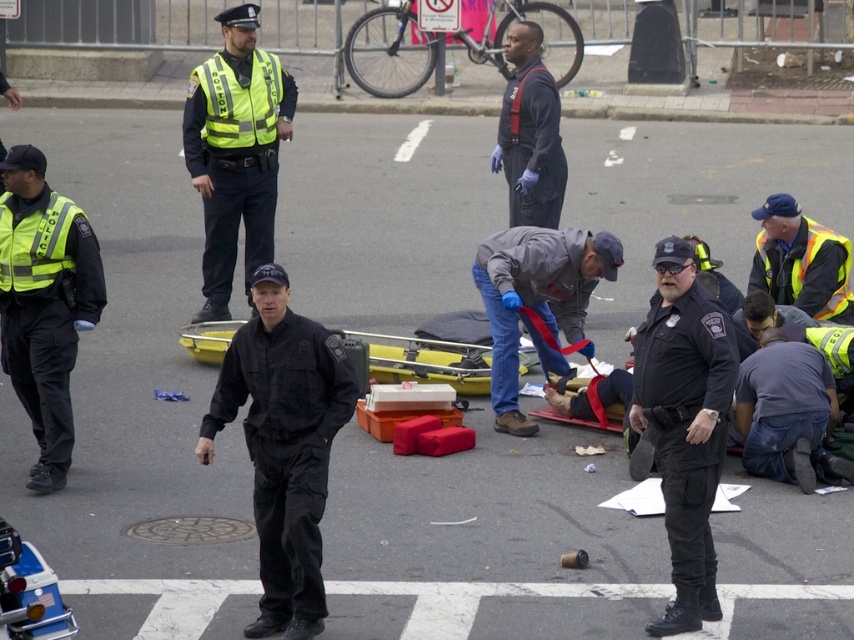
Question: Among these objects, which one is nearest to the camera?

Choices:
 (A) dark blue jeans at lower right
 (B) reflective yellow vest at left
 (C) reflective yellow vest at upper left
 (D) gray fabric jacket at center

Answer: (B)

Question: Does black uniform at center come behind dark blue jeans at lower right?

Choices:
 (A) yes
 (B) no

Answer: (B)

Question: Which point appears closest to the camera in this image?

Choices:
 (A) (812, 480)
 (B) (255, 387)

Answer: (B)

Question: Among these objects, which one is farthest from the camera?

Choices:
 (A) dark blue jeans at lower right
 (B) gray fabric jacket at center
 (C) high-visibility reflective vest at center

Answer: (C)

Question: Does black uniformed officer at center appear on the right side of gray fabric jacket at center?

Choices:
 (A) yes
 (B) no

Answer: (A)

Question: Does black uniformed officer at center have a lesser width compared to gray fabric jacket at center?

Choices:
 (A) yes
 (B) no

Answer: (A)